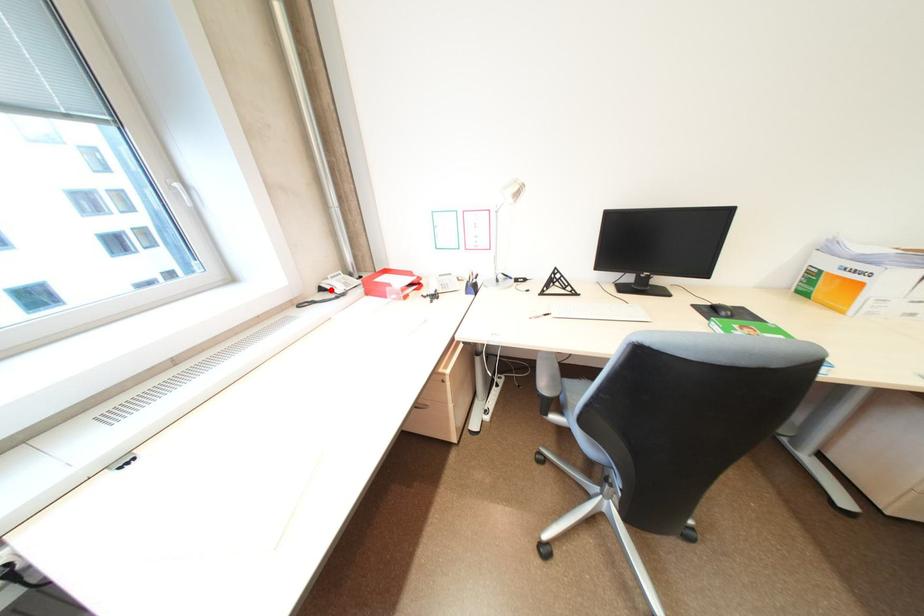
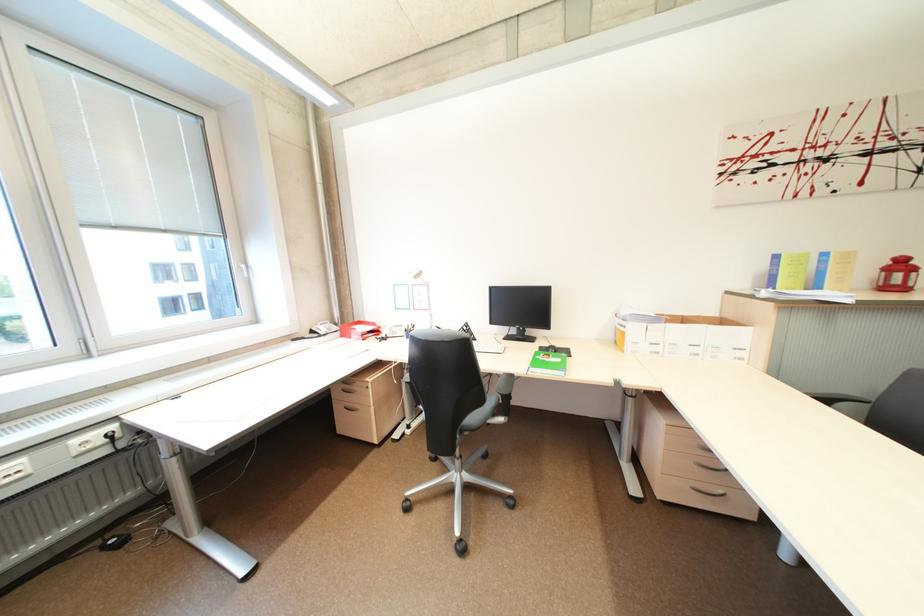
Find the pixel in the second image that matches the highlighted location in the first image.

(321, 333)